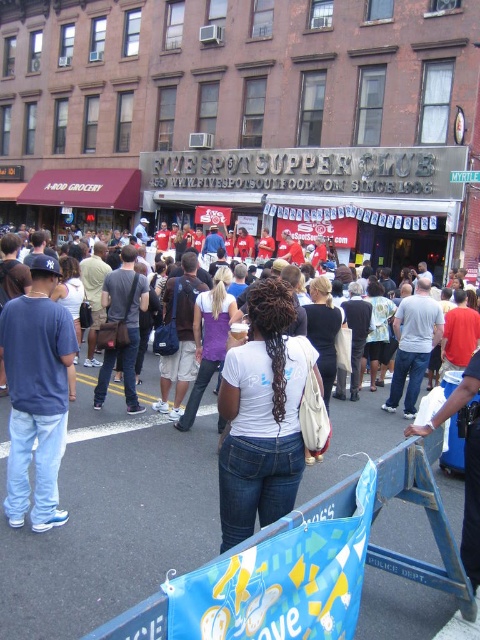
Image resolution: width=480 pixels, height=640 pixels. Identify the location of white matte shirt at center. (262, 416).

Does white matte shirt at center have a greater width compared to matte blue jeans at left?

No.

At what (x,y) coordinates should I click in order to perform the action: click on white matte shirt at center. Please return your answer as a coordinate pair (x, y). This screenshot has height=640, width=480. Looking at the image, I should click on (262, 416).